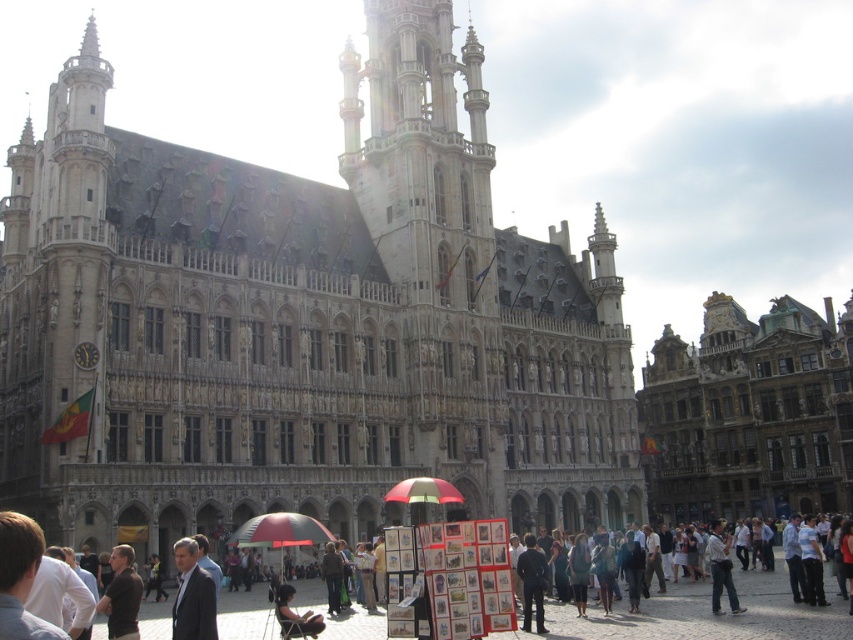
You are a photographer standing at the edge of the crowd in front of the historic building. You want to take a photo that includes both the light brown leather jacket at center and the dark brown leather jacket at lower center. Given their distance apart, can you fit both into your camera frame without moving your position?

The light brown leather jacket at center and dark brown leather jacket at lower center are 24.82 meters apart. Since most standard camera lenses have a field of view that can capture such distances when focused at that range, it is possible to include both in a single frame without moving your position.

In the scene shown: You are a tourist standing in front of the stone gothic building at center and the golden stone building at right. Which building should you look up more to fully see its height?

The stone gothic building at center is much taller than the golden stone building at right, so you should look up more to fully see its height.

You are standing in front of the historic building and want to determine the relative positions of two points marked in the scene. Which of the two points, point 1 at coordinates point 1 at coordinates point (303, 412) or point 2 at coordinates point (724, 378), is closer to you?

Point 1 at coordinates point (303, 412) is closer to the viewer than point 2 at coordinates point (724, 378).